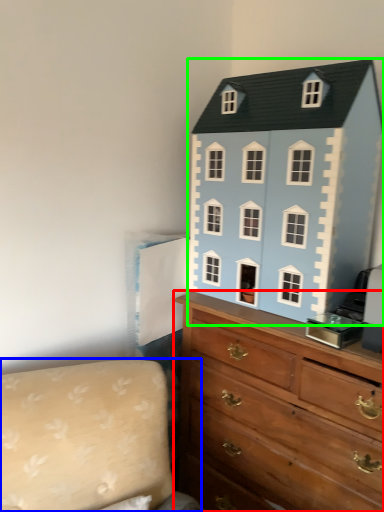
Question: Considering the real-world distances, which object is farthest from chest of drawers (highlighted by a red box)? couch (highlighted by a blue box) or toy (highlighted by a green box)?

Choices:
 (A) couch
 (B) toy

Answer: (A)